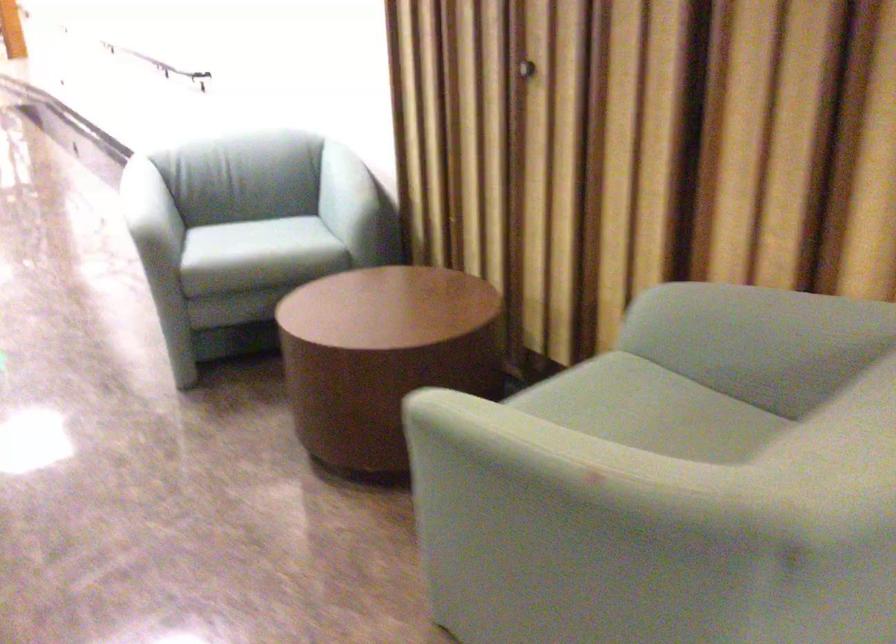
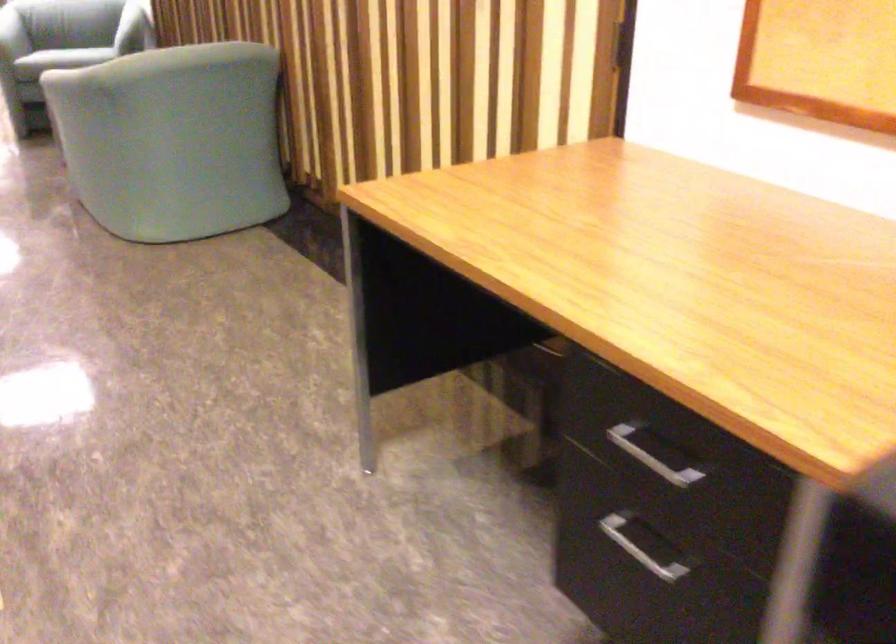
The point at (237,259) is marked in the first image. Where is the corresponding point in the second image?

(12, 35)